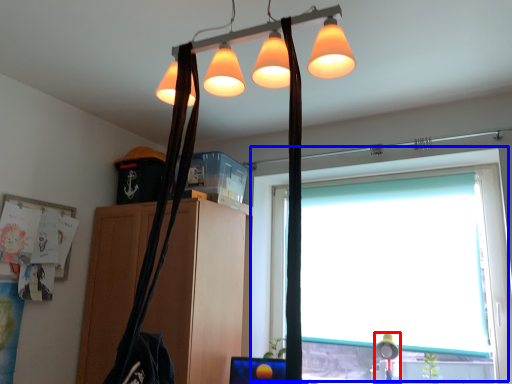
Question: Which object appears closest to the camera in this image, table lamp (highlighted by a red box) or window (highlighted by a blue box)?

Choices:
 (A) table lamp
 (B) window

Answer: (B)